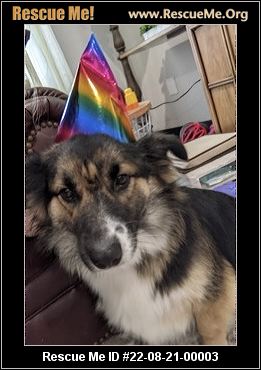
You are a GUI agent. You are given a task and a screenshot of the screen. Output one action in this format:
    pyautogui.click(x=<x>, y=<y>)
    Task: Click on the white fur
    
    Given the screenshot: What is the action you would take?
    pyautogui.click(x=133, y=298)